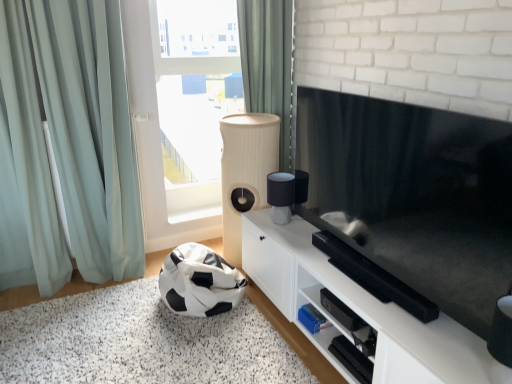
Locate an element on the screen. vacant space underneath black glossy tv at center (from a real-world perspective) is located at coordinates (364, 282).